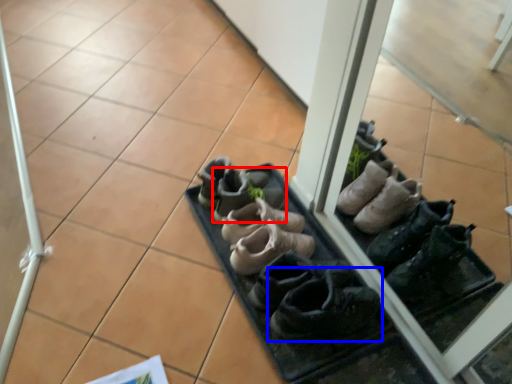
Question: Which object is further to the camera taking this photo, footwear (highlighted by a red box) or footwear (highlighted by a blue box)?

Choices:
 (A) footwear
 (B) footwear

Answer: (A)